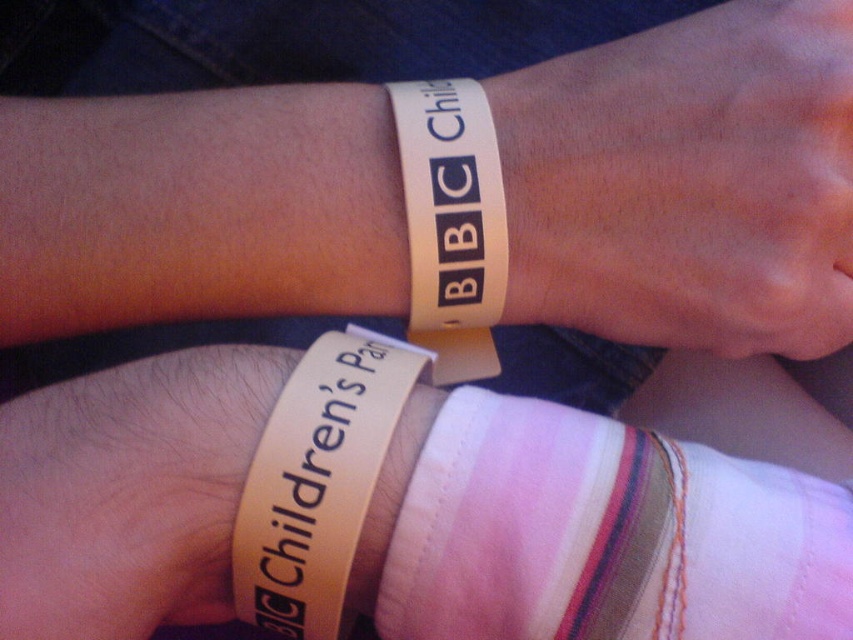
Locate an element on the screen. The width and height of the screenshot is (853, 640). white matte wristband at upper center is located at coordinates (688, 182).

Between white matte wristband at upper center and tan rubber wristband at lower center, which one is positioned higher?

Positioned higher is white matte wristband at upper center.

Where is `white matte wristband at upper center`? This screenshot has height=640, width=853. white matte wristband at upper center is located at coordinates (688, 182).

Is point (335, 433) more distant than point (453, 104)?

No, (335, 433) is closer to viewer.

Does tan rubber wristband at lower center have a smaller size compared to white paper wristband at upper right?

Incorrect, tan rubber wristband at lower center is not smaller in size than white paper wristband at upper right.

The image size is (853, 640). I want to click on tan rubber wristband at lower center, so click(x=318, y=481).

Where is `tan rubber wristband at lower center`? The height and width of the screenshot is (640, 853). tan rubber wristband at lower center is located at coordinates (318, 481).

Who is shorter, white matte wristband at upper center or white paper wristband at upper right?

Standing shorter between the two is white paper wristband at upper right.

Between white matte wristband at upper center and white paper wristband at upper right, which one appears on the right side from the viewer's perspective?

From the viewer's perspective, white matte wristband at upper center appears more on the right side.

Locate an element on the screen. Image resolution: width=853 pixels, height=640 pixels. white matte wristband at upper center is located at coordinates (688, 182).